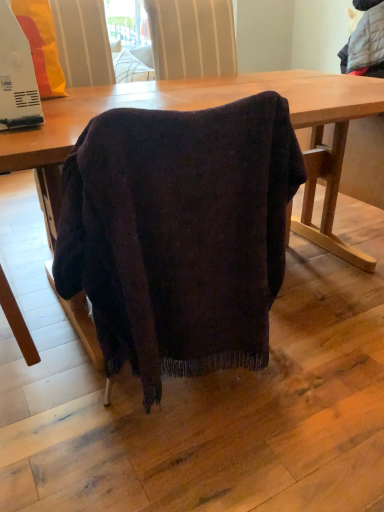
In order to click on vacant region to the left of dark wood table at center in this screenshot , I will do `click(46, 371)`.